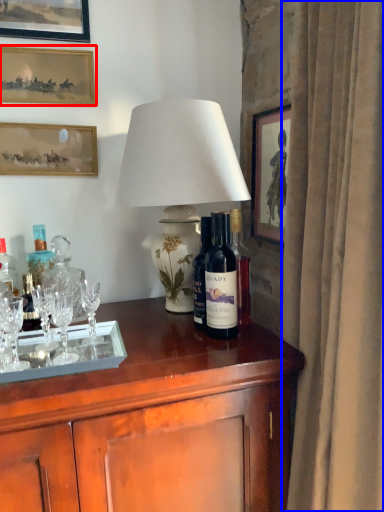
Question: Which object is closer to the camera taking this photo, picture frame (highlighted by a red box) or curtain (highlighted by a blue box)?

Choices:
 (A) picture frame
 (B) curtain

Answer: (B)